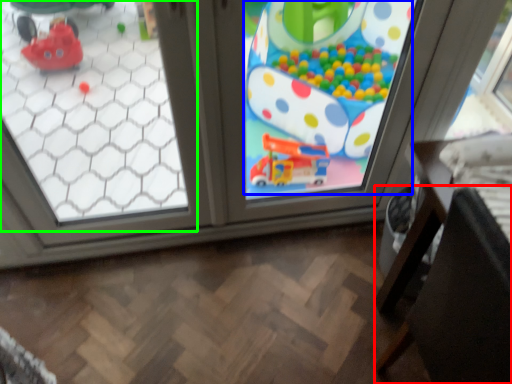
Question: Which object is the farthest from chair (highlighted by a red box)? Choose among these: toy (highlighted by a blue box) or window (highlighted by a green box).

Choices:
 (A) toy
 (B) window

Answer: (B)